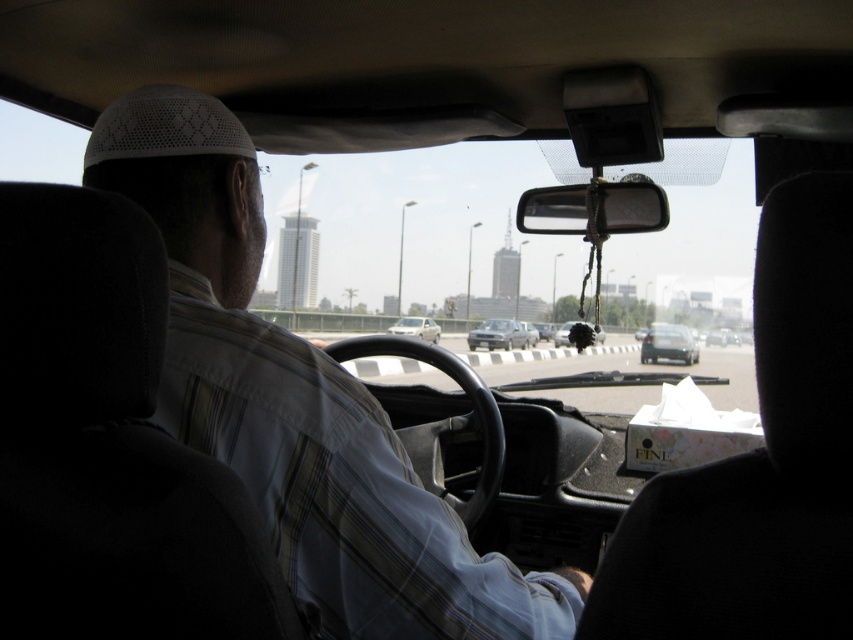
Is metallic silver sedan at center thinner than satin silver sedan at center?

No.

You are a GUI agent. You are given a task and a screenshot of the screen. Output one action in this format:
    pyautogui.click(x=<x>, y=<y>)
    Task: Click on the metallic silver sedan at center
    The height and width of the screenshot is (640, 853).
    Given the screenshot: What is the action you would take?
    pyautogui.click(x=498, y=333)

The image size is (853, 640). What are the coordinates of `metallic silver sedan at center` in the screenshot? It's located at (498, 333).

Between transparent glass windshield at center and matte black car at center, which one has less height?

With less height is matte black car at center.

Does point (404, 177) come in front of point (671, 332)?

Yes.

Is point (744, 321) farther from viewer compared to point (671, 337)?

No.

Image resolution: width=853 pixels, height=640 pixels. In order to click on transparent glass windshield at center in this screenshot , I will do `click(431, 240)`.

Does matte black car at center have a greater width compared to satin silver sedan at center?

Indeed, matte black car at center has a greater width compared to satin silver sedan at center.

Who is positioned more to the left, matte black car at center or satin silver sedan at center?

satin silver sedan at center

Measure the distance between point (657, 349) and camera.

The distance of point (657, 349) from camera is 20.85 meters.

What are the coordinates of `matte black car at center` in the screenshot? It's located at (668, 344).